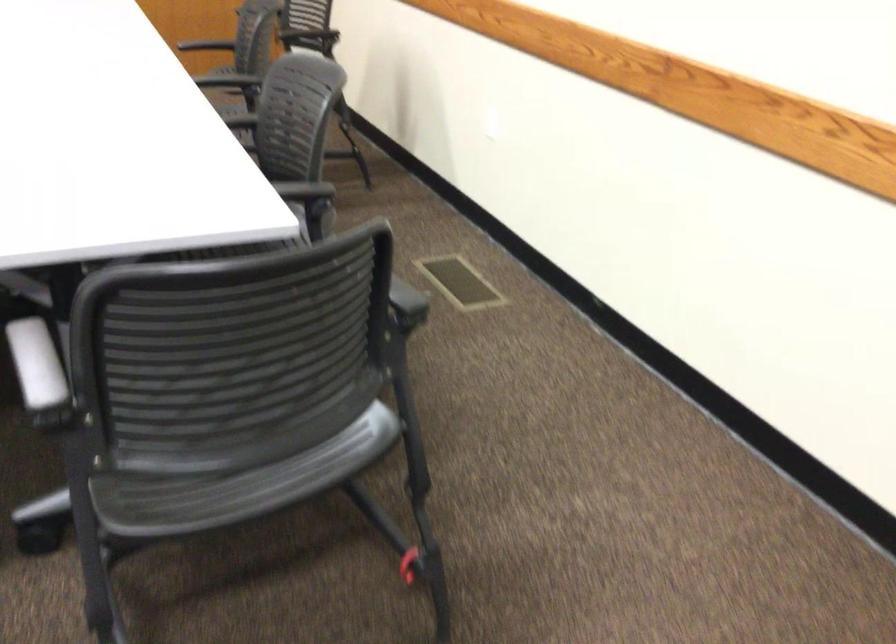
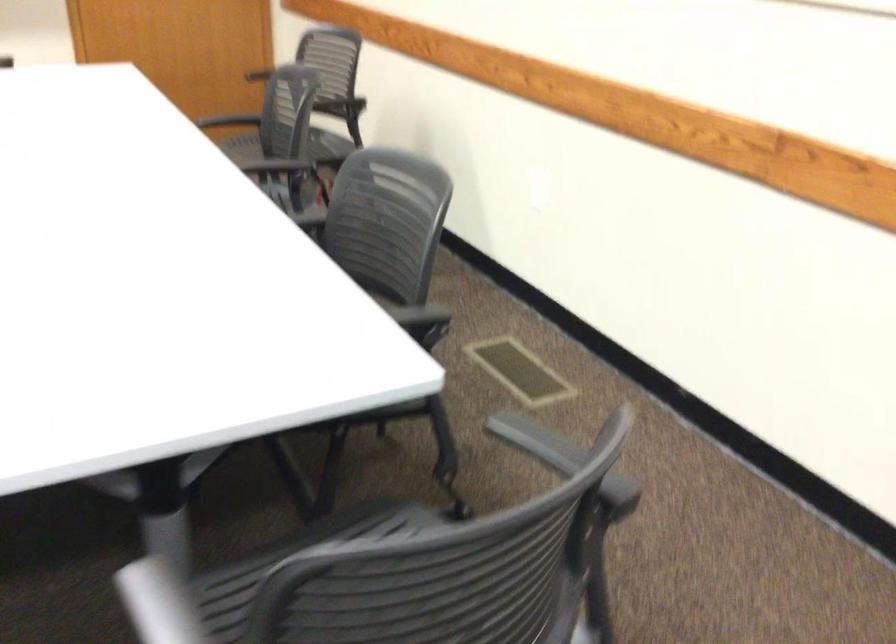
Which direction would the cameraman need to move to produce the second image?

The movement direction of the cameraman is left, forward.